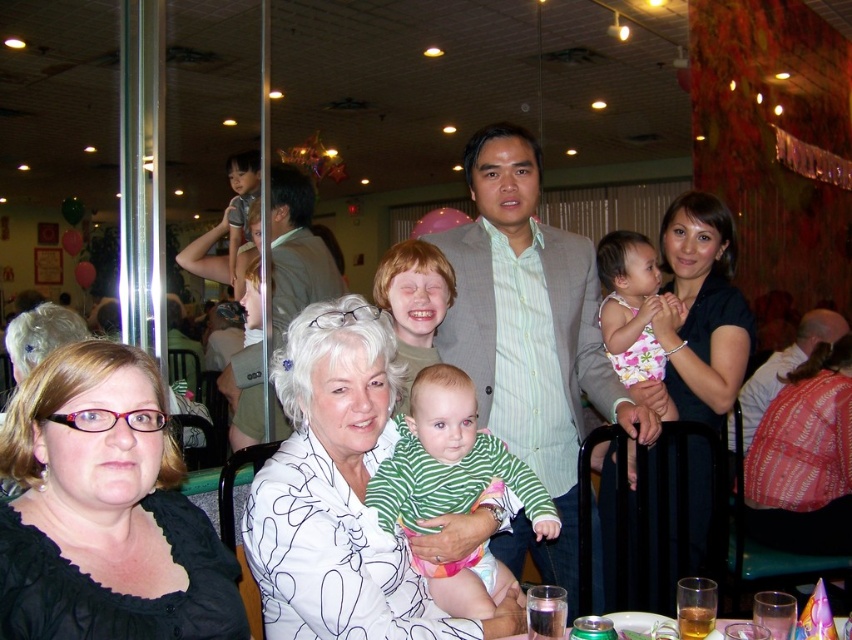
You are a photographer holding a camera. You want to take a photo of the black matte shirt at lower left from a distance that ensures the subject is in focus. If your camera has a minimum focusing distance of 36 inches, will you need to move closer or farther away?

The black matte shirt at lower left and camera are 37.30 inches apart from each other. Since the minimum focusing distance is 36 inches, you are already within range. Therefore, you do not need to move closer or farther away. You can take the photo from the current distance.

You are a photographer at the event and want to capture a photo that includes both the black matte shirt at lower left and the white dotted dress at center. Based on their positions, which one should be placed on the left side of the photo?

The black matte shirt at lower left should be placed on the left side of the photo since it is already positioned to the left of the white dotted dress at center in the scene.

Please provide the 2D coordinates of the black matte shirt at lower left in the image.

The 2D coordinates of the black matte shirt at lower left are at point (105, 513).